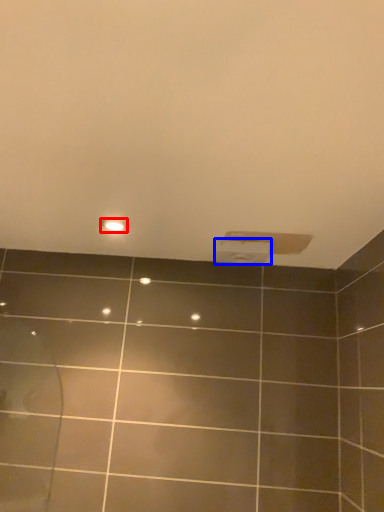
Question: Which point is further to the camera, light fixture (highlighted by a red box) or toilet paper (highlighted by a blue box)?

Choices:
 (A) light fixture
 (B) toilet paper

Answer: (B)